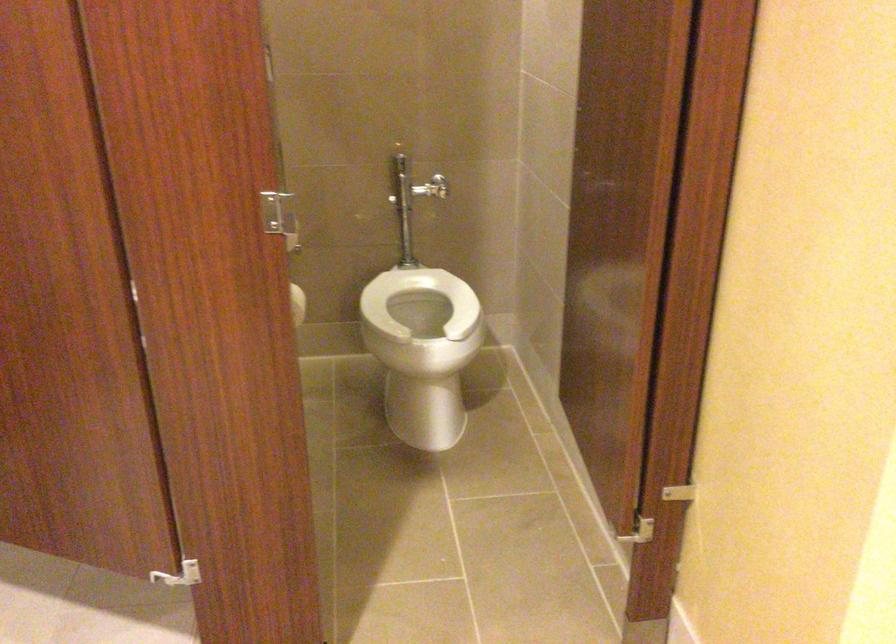
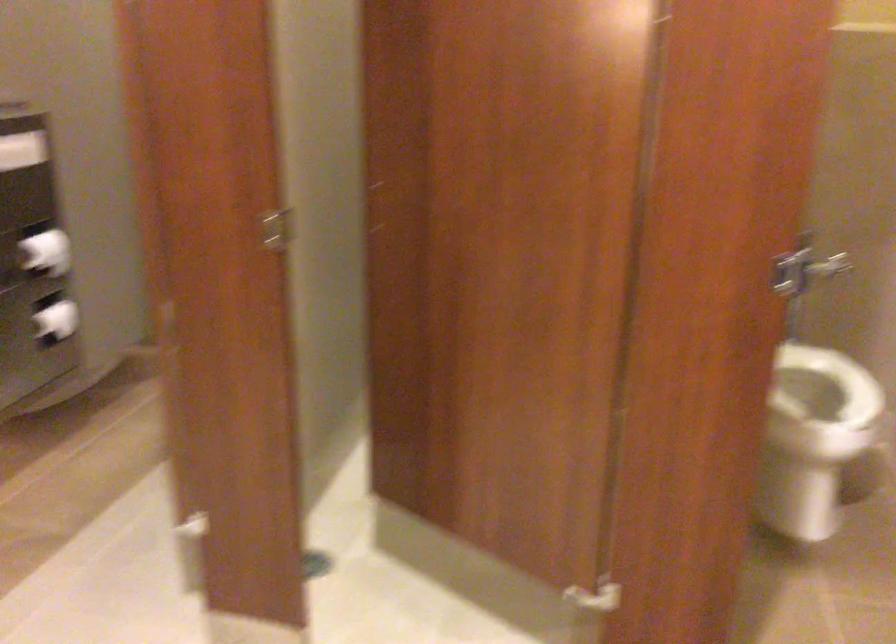
Find the pixel in the second image that matches the point at 421,201 in the first image.

(830, 266)